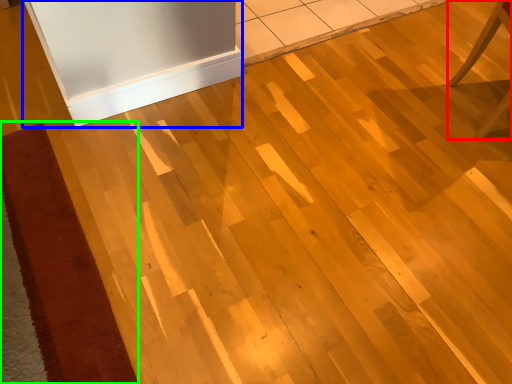
Question: Based on their relative distances, which object is farther from furniture (highlighted by a red box)? Choose from fridge (highlighted by a blue box) and doormat (highlighted by a green box).

Choices:
 (A) fridge
 (B) doormat

Answer: (B)